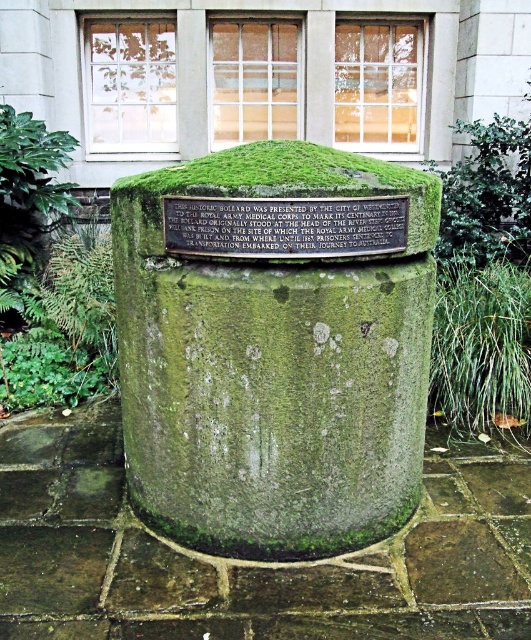
You are standing in front of the cylindrical stone bollard with the plaque. There are two points marked on the bollard at coordinates point (362, 198) and point (258, 236). Which point is closer to you?

Point (362, 198) is further to the viewer than point (258, 236), so the point closer to you is point (258, 236).

In the scene shown: You are standing in the courtyard and want to locate the green mossy stone pillar at center. According to the scene description, where would you find it?

The green mossy stone pillar at center is located at the 2D coordinates point (275, 346).

You are a sculptor who wants to create a miniature replica of the green mossy stone pillar at center and the green mossy stone plaque at center. If you want both to be proportional in size, which one should you make larger?

The green mossy stone pillar at center is bigger than the green mossy stone plaque at center, so you should make the green mossy stone pillar at center larger than the green mossy stone plaque at center in your replica to maintain proportion.